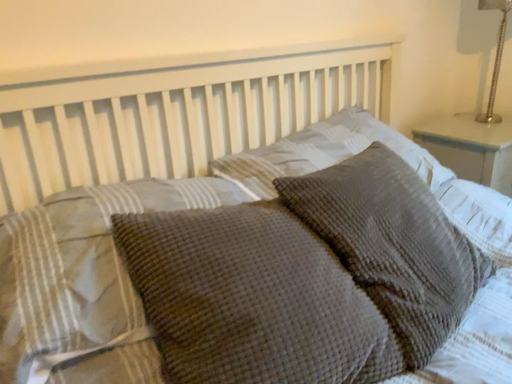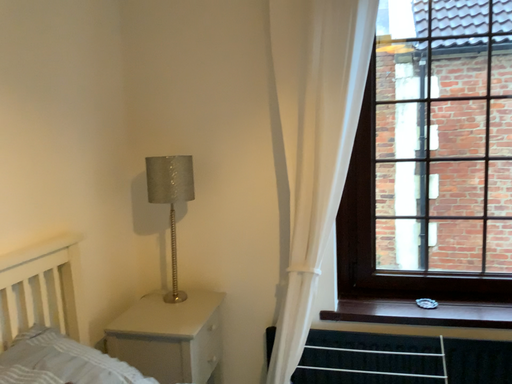
Question: How did the camera likely rotate when shooting the video?

Choices:
 (A) rotated left
 (B) rotated right

Answer: (B)